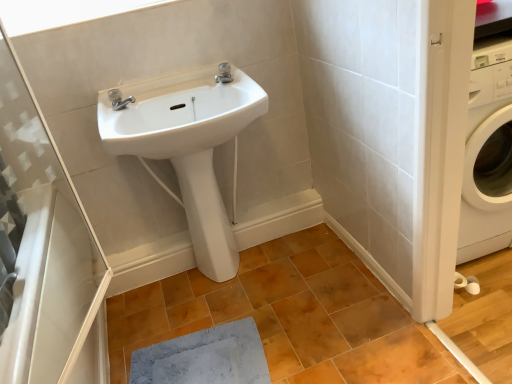
You are a GUI agent. You are given a task and a screenshot of the screen. Output one action in this format:
    pyautogui.click(x=<x>, y=<y>)
    Task: Click on the free space to the left of white glossy bidet at center
    Image resolution: width=512 pixels, height=384 pixels.
    Given the screenshot: What is the action you would take?
    pyautogui.click(x=182, y=289)